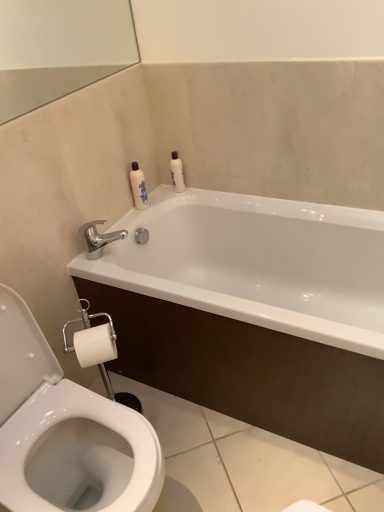
Find the location of `vacant space in front of white glossy bottle at upper right, arranged as the first toiletry when viewed from the right`. vacant space in front of white glossy bottle at upper right, arranged as the first toiletry when viewed from the right is located at coordinates (190, 193).